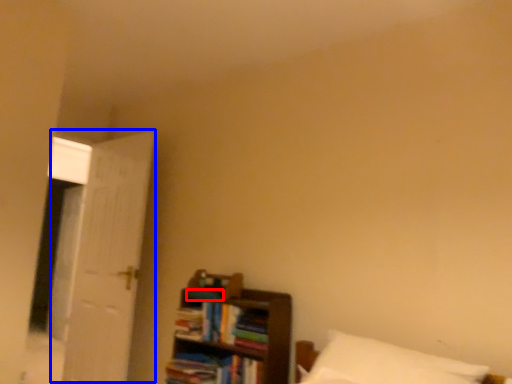
Question: Which of the following is the closest to the observer, book (highlighted by a red box) or door (highlighted by a blue box)?

Choices:
 (A) book
 (B) door

Answer: (A)